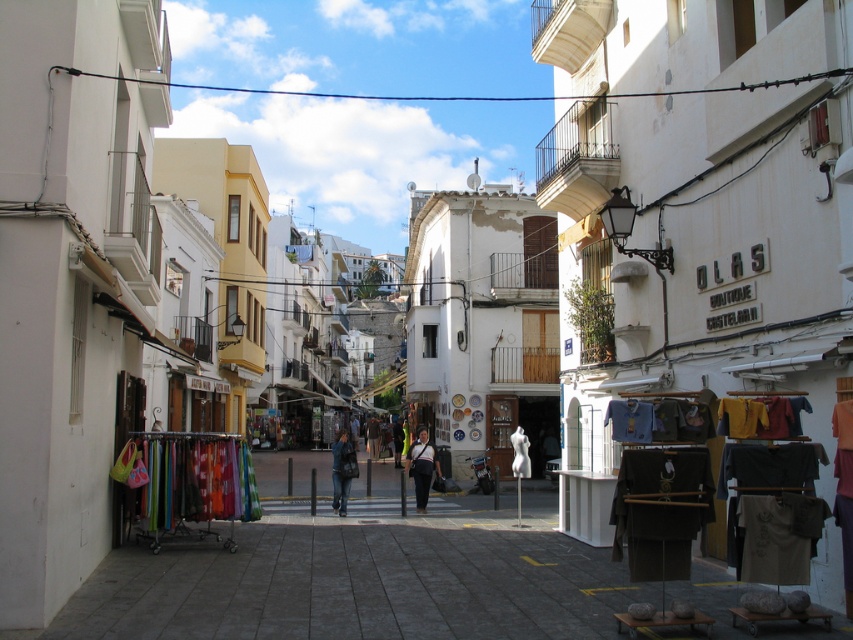
You are a photographer standing at the end of the street facing the buildings. You want to take a photo that includes both the point at coordinates point (434, 465) and point (341, 470). Which point should you focus on first to ensure both are in focus?

You should focus on point (434, 465) first because it is closer to the camera than point (341, 470). By focusing on the closer point, the depth of field may also cover the farther point, ensuring both are in focus.

In the scene shown: You are a customer in the OLAS shop and need to choose between the denim jeans at center and the dark blue jeans at center. Which pair has a larger size?

The denim jeans at center is bigger than the dark blue jeans at center, so the denim jeans at center has a larger size.

You are standing at the entrance of the street and want to buy a shirt. Where are the textured cotton shirts at right located in the scene?

The textured cotton shirts at right are located at the 2D coordinates point (766, 499) in the scene.